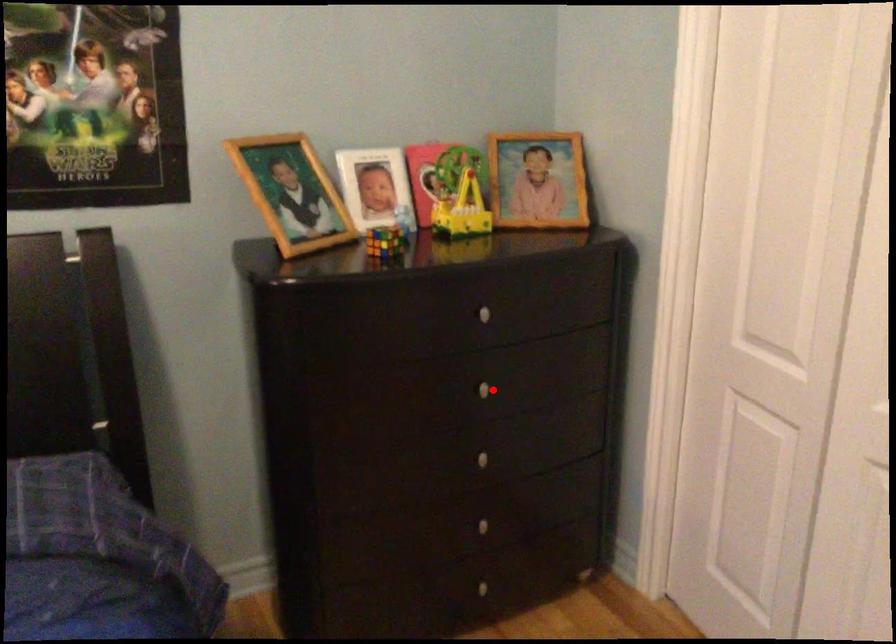
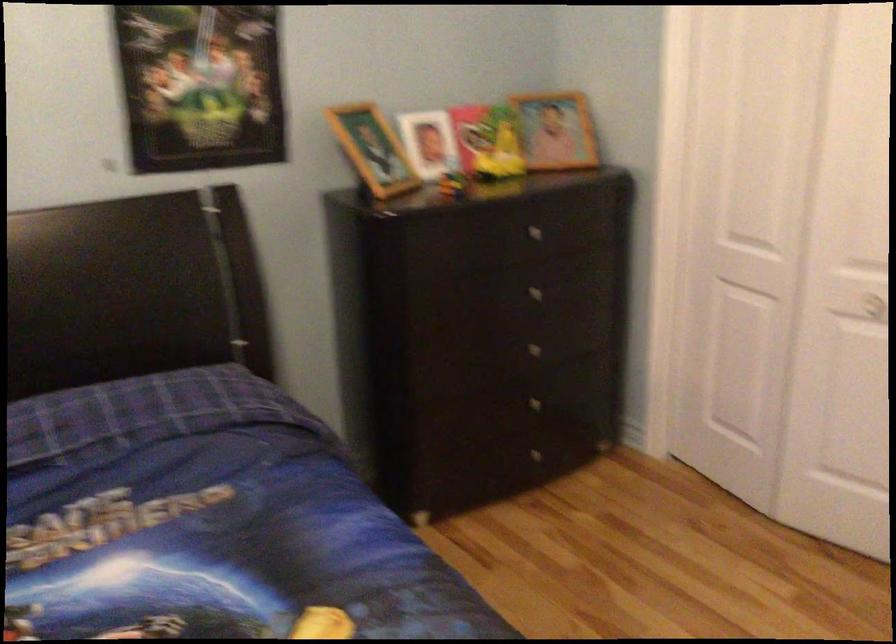
Locate, in the second image, the point that corresponds to the highlighted location in the first image.

(538, 292)